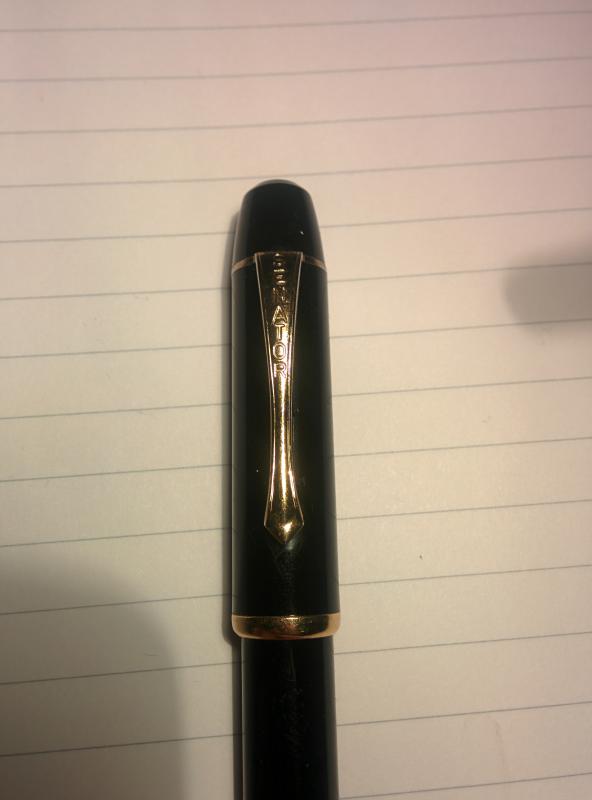
Identify the location of pen. The image size is (592, 800). (274, 686).